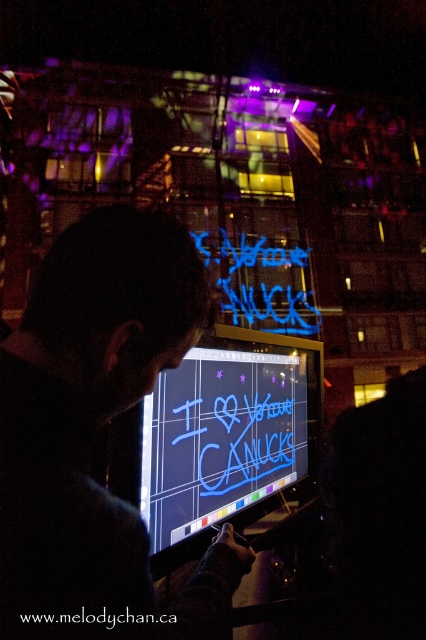
Question: Which object appears farthest from the camera in this image?

Choices:
 (A) neon blue text at center
 (B) black fabric at center

Answer: (A)

Question: Is black fabric at center to the right of neon blue text at center from the viewer's perspective?

Choices:
 (A) no
 (B) yes

Answer: (A)

Question: Which point is closer to the camera taking this photo?

Choices:
 (A) (299, 403)
 (B) (77, 264)

Answer: (B)

Question: Among these points, which one is nearest to the camera?

Choices:
 (A) (192, 326)
 (B) (183, 500)

Answer: (A)

Question: Does black fabric at center have a smaller size compared to neon blue text at center?

Choices:
 (A) yes
 (B) no

Answer: (A)

Question: Can you confirm if black fabric at center is positioned to the left of neon blue text at center?

Choices:
 (A) yes
 (B) no

Answer: (A)